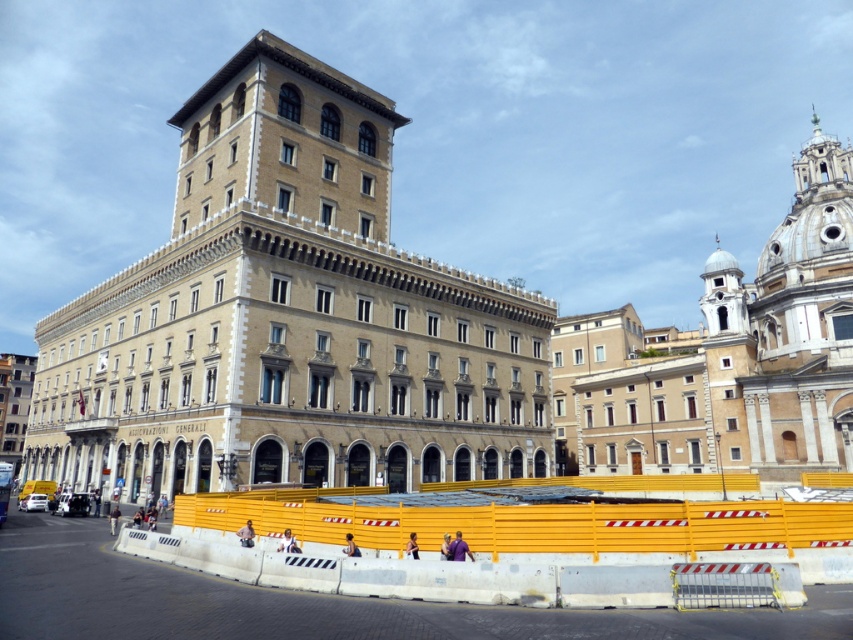
Who is taller, beige stone building at center or yellow plastic barrier at lower center?

beige stone building at center is taller.

Can you confirm if beige stone building at center is thinner than yellow plastic barrier at lower center?

No, beige stone building at center is not thinner than yellow plastic barrier at lower center.

Is point (334, 92) positioned behind point (712, 518)?

Yes, it is.

This screenshot has height=640, width=853. I want to click on beige stone building at center, so click(288, 317).

Does point (440, 365) come closer to viewer compared to point (770, 269)?

That is True.

Between beige stone building at center and white marble building at upper right, which one appears on the left side from the viewer's perspective?

From the viewer's perspective, beige stone building at center appears more on the left side.

Describe the element at coordinates (288, 317) in the screenshot. This screenshot has height=640, width=853. I see `beige stone building at center` at that location.

I want to click on beige stone building at center, so click(x=288, y=317).

Can you confirm if white marble building at upper right is positioned to the right of yellow plastic barrier at lower center?

Correct, you'll find white marble building at upper right to the right of yellow plastic barrier at lower center.

Image resolution: width=853 pixels, height=640 pixels. What do you see at coordinates (727, 355) in the screenshot?
I see `white marble building at upper right` at bounding box center [727, 355].

Image resolution: width=853 pixels, height=640 pixels. I want to click on white marble building at upper right, so click(x=727, y=355).